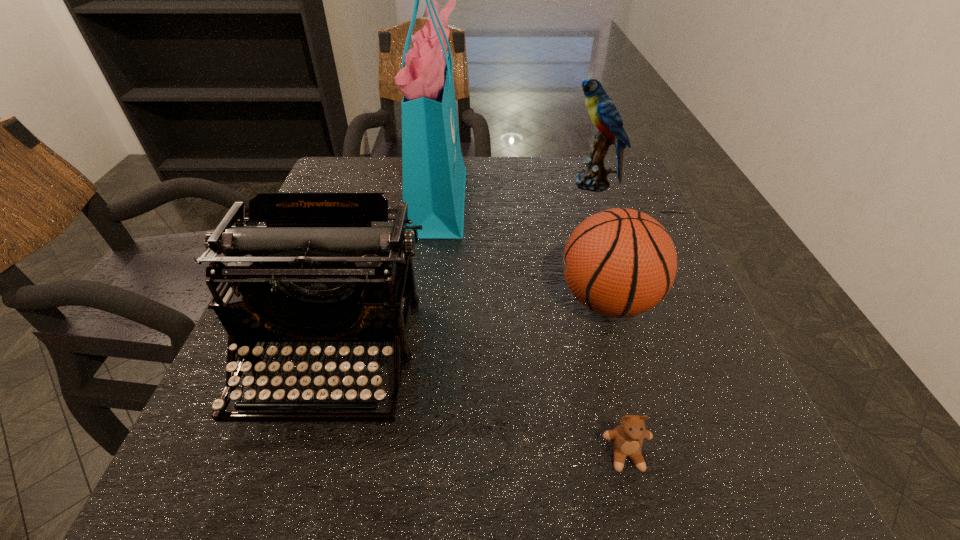
The height and width of the screenshot is (540, 960). I want to click on free space that is in between the shopping bag and the teddy bear, so click(532, 326).

At what (x,y) coordinates should I click in order to perform the action: click on free space between the tallest object and the parrot. Please return your answer as a coordinate pair (x, y). The image size is (960, 540). Looking at the image, I should click on (516, 191).

In order to click on free spot between the typewriter and the shortest object in this screenshot , I will do `click(479, 406)`.

Identify the location of free area in between the parrot and the nearest object. This screenshot has width=960, height=540. (609, 319).

You are a GUI agent. You are given a task and a screenshot of the screen. Output one action in this format:
    pyautogui.click(x=<x>, y=<y>)
    Task: Click on the free space between the typewriter and the parrot
    
    Given the screenshot: What is the action you would take?
    pyautogui.click(x=463, y=271)

The image size is (960, 540). I want to click on object that is the third closest to the basketball, so click(x=318, y=271).

Where is `object that ranks as the second closest to the parrot`? The height and width of the screenshot is (540, 960). object that ranks as the second closest to the parrot is located at coordinates (x=620, y=262).

In order to click on vacant space that satisfies the following two spatial constraints: 1. on the side where the inflation valve is located; 2. on the front-facing side of the teddy bear in this screenshot , I will do `click(653, 455)`.

Identify the location of free space that satisfies the following two spatial constraints: 1. on the face of the parrot; 2. on the typing side of the typewriter. This screenshot has height=540, width=960. (653, 357).

What are the coordinates of `vacant position in the image that satisfies the following two spatial constraints: 1. on the side where the inflation valve is located; 2. on the typing side of the typewriter` in the screenshot? It's located at (624, 357).